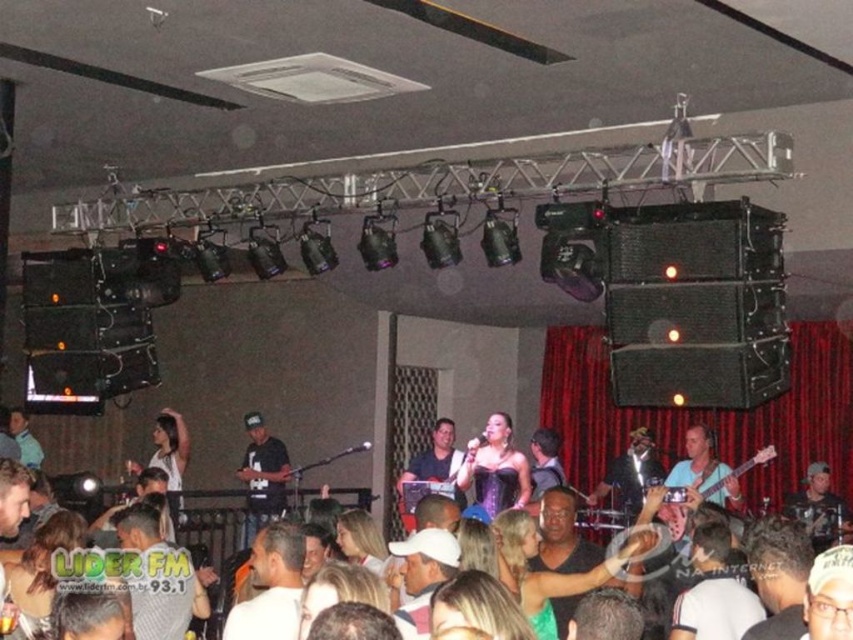
You are a stagehand who needs to place a 10 feet long extension cord between the white matte shirt at center and the black matte shirt at center. Is there enough space to lay the cord straight without bending it?

The distance between the white matte shirt at center and the black matte shirt at center is 14.26 feet, so yes, the 10 feet long extension cord can be placed straight between them as the distance is sufficient.